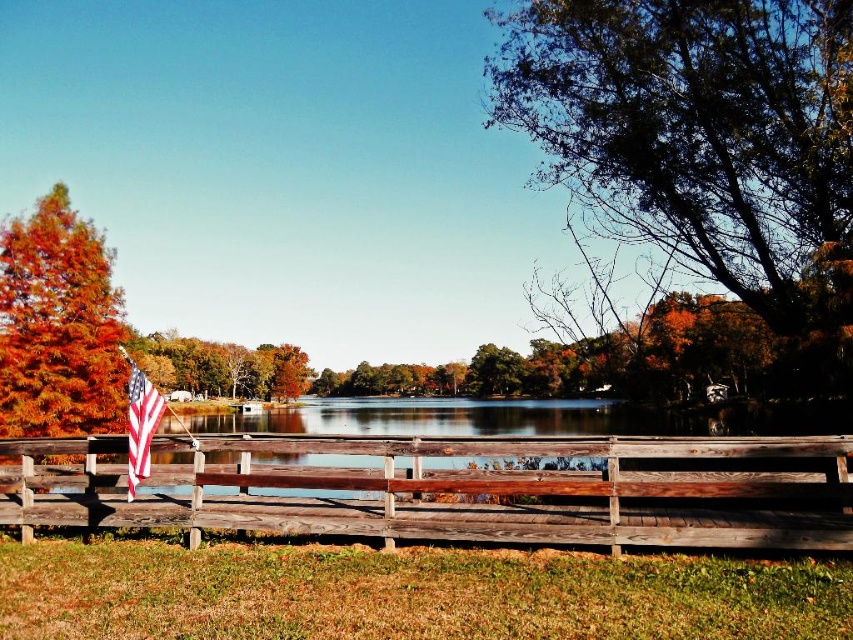
You are standing at the lakeside and want to take a photo of the green leafy tree at upper right and the american flag at left. Which object should you adjust your camera focus on first to ensure both are in the frame?

You should focus on the american flag at left first because it is closer to you than the green leafy tree at upper right, which is further away. By focusing on the closer object, you can ensure both are within the depth of field.

You are standing at the center of the image and want to locate the orange matte tree at left. In which direction should you look to see it?

The orange matte tree at left is located at point (x=59, y=324), which means it is positioned to the left of the center. Therefore, you should look to the left to see it.